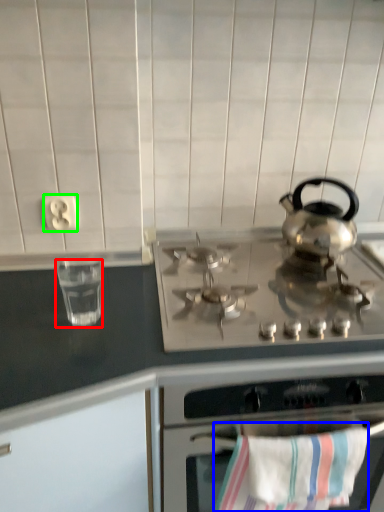
Question: Based on their relative distances, which object is farther from appliance (highlighted by a red box)? Choose from beach towel (highlighted by a blue box) and electric outlet (highlighted by a green box).

Choices:
 (A) beach towel
 (B) electric outlet

Answer: (A)